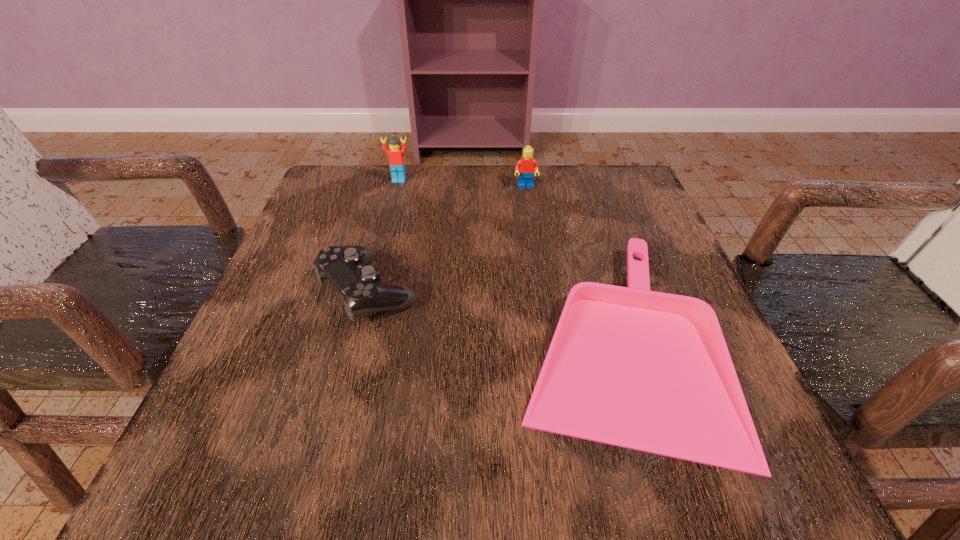
This screenshot has height=540, width=960. Find the location of `vacant area that lies between the right Lego and the shortest object`. vacant area that lies between the right Lego and the shortest object is located at coordinates tap(569, 264).

You are a GUI agent. You are given a task and a screenshot of the screen. Output one action in this format:
    pyautogui.click(x=<x>, y=<y>)
    Task: Click on the empty space that is in between the farther Lego and the control
    
    Given the screenshot: What is the action you would take?
    pyautogui.click(x=384, y=235)

The image size is (960, 540). Identify the location of free space between the second shortest object and the left Lego. (384, 235).

Identify the location of blank region between the shortest object and the control. (491, 316).

Identify the location of free space between the dustpan and the nearer Lego. This screenshot has height=540, width=960. (569, 264).

The width and height of the screenshot is (960, 540). Identify the location of empty space that is in between the right Lego and the shortest object. (569, 264).

At what (x,y) coordinates should I click in order to perform the action: click on object that is the nearest to the dustpan. Please return your answer as a coordinate pair (x, y). Image resolution: width=960 pixels, height=540 pixels. Looking at the image, I should click on (345, 267).

Identify which object is the second nearest to the farther Lego. Please provide its 2D coordinates. Your answer should be formatted as a tuple, i.e. [(x, y)], where the tuple contains the x and y coordinates of a point satisfying the conditions above.

[(345, 267)]